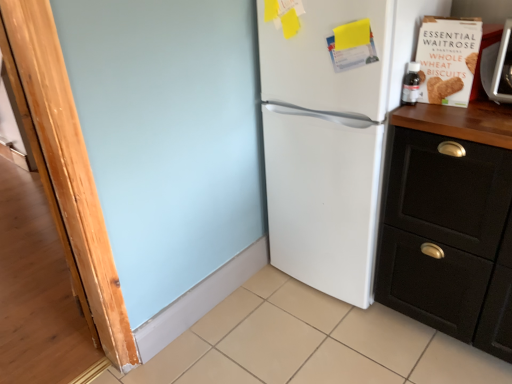
Image resolution: width=512 pixels, height=384 pixels. In order to click on beige tile at lower center in this screenshot , I will do `click(310, 344)`.

Image resolution: width=512 pixels, height=384 pixels. Identify the location of refrigerator behind the black matte cabinet at right. (324, 202).

Is black matte cabinet at right not close to white matte refrigerator at center?

black matte cabinet at right is near white matte refrigerator at center, not far away.

Considering the relative positions of black matte cabinet at right and white matte refrigerator at center in the image provided, is black matte cabinet at right to the right of white matte refrigerator at center from the viewer's perspective?

Yes, black matte cabinet at right is to the right of white matte refrigerator at center.

From the image's perspective, is black matte cabinet at right beneath white matte refrigerator at center?

Yes, from the image's perspective, black matte cabinet at right is beneath white matte refrigerator at center.

Between beige tile at lower center and white matte refrigerator at center, which one appears on the left side from the viewer's perspective?

Positioned to the left is beige tile at lower center.

Is beige tile at lower center oriented towards white matte refrigerator at center?

No.

Are beige tile at lower center and white matte refrigerator at center located far from each other?

No, beige tile at lower center is not far from white matte refrigerator at center.

Which is behind, beige tile at lower center or white matte refrigerator at center?

white matte refrigerator at center is further away from the camera.

Is black matte cabinet at right oriented towards beige tile at lower center?

Yes, black matte cabinet at right is oriented towards beige tile at lower center.

Would you say black matte cabinet at right is a long distance from beige tile at lower center?

That's not correct — black matte cabinet at right is a little close to beige tile at lower center.

Considering the positions of points (407, 230) and (279, 356), is point (407, 230) closer to camera compared to point (279, 356)?

Yes.

From a real-world perspective, is white matte refrigerator at center positioned over black matte cabinet at right based on gravity?

Yes, from a real-world perspective, white matte refrigerator at center is over black matte cabinet at right

Can you confirm if white matte refrigerator at center is bigger than black matte cabinet at right?

Correct, white matte refrigerator at center is larger in size than black matte cabinet at right.

Is white matte refrigerator at center wider than black matte cabinet at right?

Correct, the width of white matte refrigerator at center exceeds that of black matte cabinet at right.

Which object is positioned more to the left, white matte refrigerator at center or black matte cabinet at right?

From the viewer's perspective, white matte refrigerator at center appears more on the left side.

From the picture: Is beige tile at lower center wider than black matte cabinet at right?

Correct, the width of beige tile at lower center exceeds that of black matte cabinet at right.

Is beige tile at lower center further to camera compared to black matte cabinet at right?

No, it is not.

From a real-world perspective, is beige tile at lower center on top of black matte cabinet at right?

No, from a real-world perspective, beige tile at lower center is not above black matte cabinet at right.

Is beige tile at lower center shorter than black matte cabinet at right?

Yes, beige tile at lower center is shorter than black matte cabinet at right.

From the image's perspective, which one is positioned higher, white matte refrigerator at center or beige tile at lower center?

white matte refrigerator at center is shown above in the image.

Locate an element on the screen. tile lying on the left of white matte refrigerator at center is located at coordinates (310, 344).

Considering the positions of point (292, 238) and point (291, 326), is point (292, 238) closer or farther from the camera than point (291, 326)?

Point (292, 238) is farther from the camera than point (291, 326).

Considering the sizes of white matte refrigerator at center and beige tile at lower center in the image, is white matte refrigerator at center wider or thinner than beige tile at lower center?

Clearly, white matte refrigerator at center has less width compared to beige tile at lower center.

The image size is (512, 384). I want to click on refrigerator lying above the black matte cabinet at right (from the image's perspective), so click(x=324, y=202).

Locate an element on the screen. The width and height of the screenshot is (512, 384). refrigerator that appears above the beige tile at lower center (from a real-world perspective) is located at coordinates (324, 202).

When comparing their distances from black matte cabinet at right, does beige tile at lower center or white matte refrigerator at center seem further?

beige tile at lower center lies further to black matte cabinet at right than the other object.

Which object lies further to the anchor point beige tile at lower center, black matte cabinet at right or white matte refrigerator at center?

white matte refrigerator at center lies further to beige tile at lower center than the other object.

When comparing their distances from white matte refrigerator at center, does beige tile at lower center or black matte cabinet at right seem further?

beige tile at lower center.

Which object lies nearer to the anchor point beige tile at lower center, white matte refrigerator at center or black matte cabinet at right?

The object closer to beige tile at lower center is black matte cabinet at right.

Based on their spatial positions, is black matte cabinet at right or beige tile at lower center further from white matte refrigerator at center?

beige tile at lower center.

From the image, which object appears to be nearer to black matte cabinet at right, white matte refrigerator at center or beige tile at lower center?

The object closer to black matte cabinet at right is white matte refrigerator at center.

The height and width of the screenshot is (384, 512). What are the coordinates of `cabinetry that lies between white matte refrigerator at center and beige tile at lower center from top to bottom` in the screenshot? It's located at (449, 238).